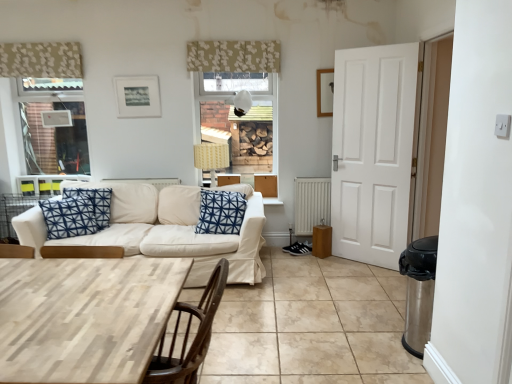
Question: Considering the relative sizes of patterned fabric curtain at upper left, the first curtain viewed from the left, and wooden picture frame at upper right, marked as the second picture frame in a left-to-right arrangement, in the image provided, is patterned fabric curtain at upper left, the first curtain viewed from the left, wider than wooden picture frame at upper right, marked as the second picture frame in a left-to-right arrangement,?

Choices:
 (A) yes
 (B) no

Answer: (A)

Question: Is patterned fabric curtain at upper left, the first curtain viewed from the left, positioned beyond the bounds of wooden picture frame at upper right, positioned as the 1th picture frame in right-to-left order?

Choices:
 (A) yes
 (B) no

Answer: (A)

Question: Are patterned fabric curtain at upper left, which is the 2th curtain in right-to-left order, and wooden picture frame at upper right, positioned as the 1th picture frame in right-to-left order, located far from each other?

Choices:
 (A) no
 (B) yes

Answer: (B)

Question: Can you confirm if patterned fabric curtain at upper left, which is the 2th curtain in right-to-left order, is taller than wooden picture frame at upper right, positioned as the 1th picture frame in right-to-left order?

Choices:
 (A) no
 (B) yes

Answer: (A)

Question: Considering the relative sizes of patterned fabric curtain at upper left, the first curtain viewed from the left, and wooden picture frame at upper right, positioned as the 1th picture frame in right-to-left order, in the image provided, is patterned fabric curtain at upper left, the first curtain viewed from the left, bigger than wooden picture frame at upper right, positioned as the 1th picture frame in right-to-left order,?

Choices:
 (A) yes
 (B) no

Answer: (A)

Question: From a real-world perspective, is patterned fabric curtain at upper left, which is the 2th curtain in right-to-left order, located beneath wooden picture frame at upper right, marked as the second picture frame in a left-to-right arrangement?

Choices:
 (A) yes
 (B) no

Answer: (B)

Question: From the image's perspective, does white metallic radiator at lower center appear higher than light wood table at lower left?

Choices:
 (A) no
 (B) yes

Answer: (B)

Question: Is white metallic radiator at lower center not close to light wood table at lower left?

Choices:
 (A) yes
 (B) no

Answer: (A)

Question: Are white metallic radiator at lower center and light wood table at lower left beside each other?

Choices:
 (A) yes
 (B) no

Answer: (B)

Question: Is white metallic radiator at lower center bigger than light wood table at lower left?

Choices:
 (A) no
 (B) yes

Answer: (A)

Question: Is light wood table at lower left at the back of white metallic radiator at lower center?

Choices:
 (A) no
 (B) yes

Answer: (A)

Question: Can you confirm if white metallic radiator at lower center is positioned to the left of light wood table at lower left?

Choices:
 (A) yes
 (B) no

Answer: (B)

Question: From the image's perspective, is light wood table at lower left beneath matte black picture frame at upper center, which ranks as the 1th picture frame in left-to-right order?

Choices:
 (A) no
 (B) yes

Answer: (B)